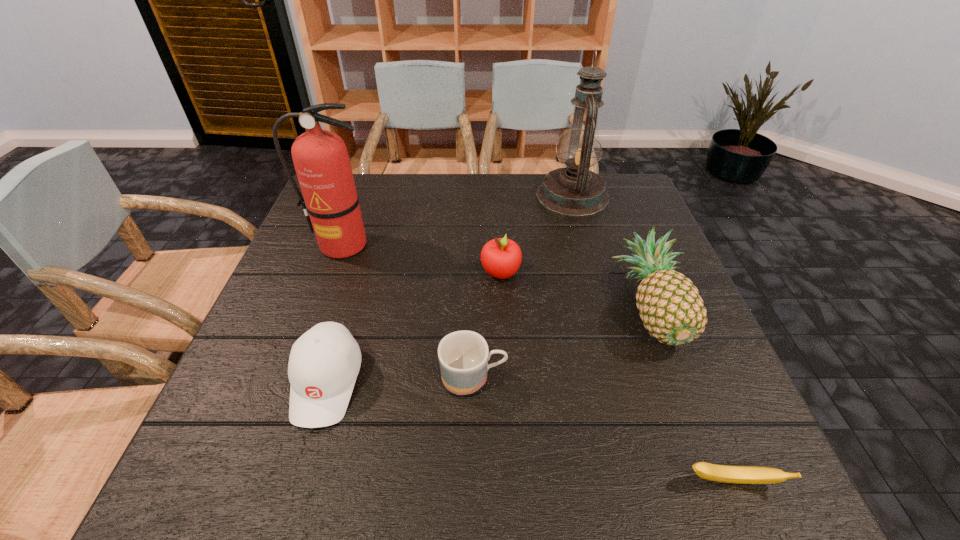
Where is `oil lamp`? Image resolution: width=960 pixels, height=540 pixels. oil lamp is located at coordinates (575, 191).

Identify the location of fire extinguisher. (330, 201).

The width and height of the screenshot is (960, 540). Find the location of `the fifth shortest object`. the fifth shortest object is located at coordinates (670, 306).

The width and height of the screenshot is (960, 540). Identify the location of apple. (501, 257).

Where is `baseball cap`? The width and height of the screenshot is (960, 540). baseball cap is located at coordinates (324, 362).

At what (x,y) coordinates should I click in order to perform the action: click on mug. Please return your answer as a coordinate pair (x, y). The height and width of the screenshot is (540, 960). Looking at the image, I should click on (463, 356).

Find the location of a particular element. the shortest object is located at coordinates (721, 473).

The height and width of the screenshot is (540, 960). I want to click on banana, so click(x=721, y=473).

At what (x,y) coordinates should I click in order to perform the action: click on vacant area situated on the left of the oil lamp. Please return your answer as a coordinate pair (x, y). The width and height of the screenshot is (960, 540). Looking at the image, I should click on (453, 196).

Identify the location of free region located on the side of the fire extinguisher with the nozzle and handle. (320, 307).